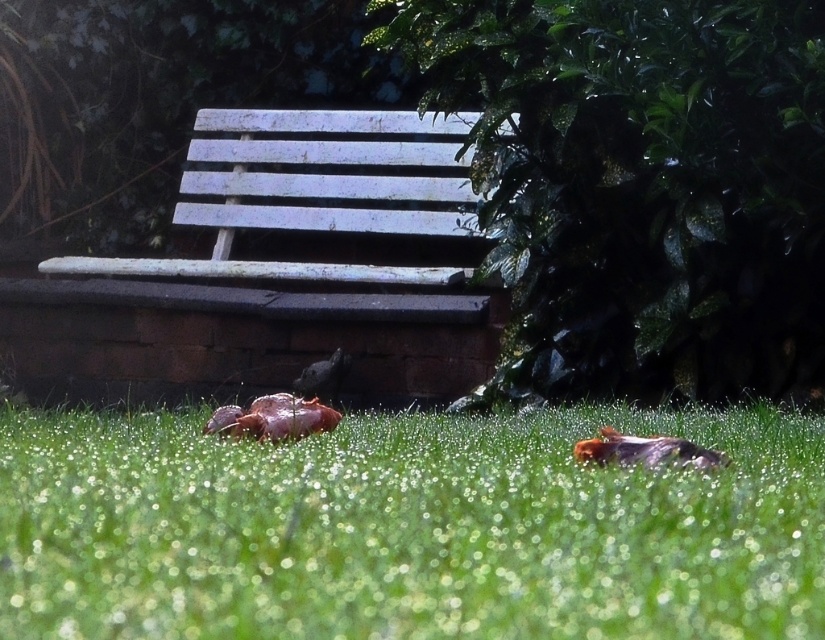
You are a photographer trying to capture the white painted wood bench at upper center and the brown speckled feathers at lower center in the same frame. Based on their positions, which object should you adjust your camera to focus on first if you want to include both in your shot?

The white painted wood bench at upper center is to the left of the brown speckled feathers at lower center, so you should focus on the white painted wood bench at upper center first to ensure both are in the frame.

You are a photographer trying to capture the white painted wood bench at upper center and the brown speckled feathers at lower center in the same frame. Based on their positions, which object appears closer to you in the photo?

The white painted wood bench at upper center appears closer to you because it is further to the viewer than the brown speckled feathers at lower center.